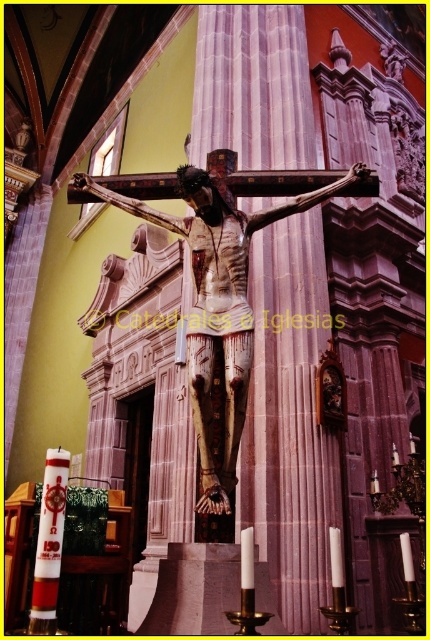
Question: Which point is farther to the camera?

Choices:
 (A) white glossy candle at lower left
 (B) wooden crucifix at center

Answer: (B)

Question: Which point appears closest to the camera in this image?

Choices:
 (A) 208,499
 (B) 46,490

Answer: (B)

Question: Does wooden crucifix at center have a smaller size compared to white glossy candle at lower left?

Choices:
 (A) yes
 (B) no

Answer: (A)

Question: From the image, what is the correct spatial relationship of wooden crucifix at center in relation to white glossy candle at lower left?

Choices:
 (A) above
 (B) below

Answer: (A)

Question: Can you confirm if wooden crucifix at center is bigger than white glossy candle at lower left?

Choices:
 (A) no
 (B) yes

Answer: (A)